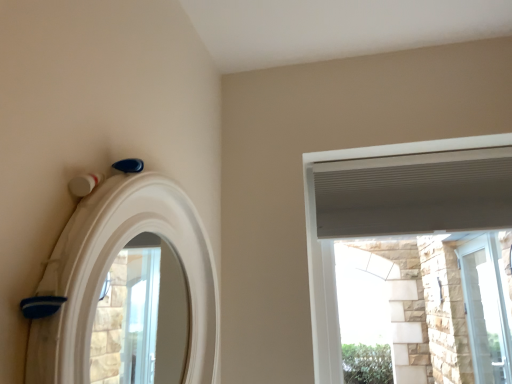
Question: Is white textured window at upper right, marked as the first window in a left-to-right arrangement, taller or shorter than white matte archway at upper left?

Choices:
 (A) tall
 (B) short

Answer: (A)

Question: Is point (423, 173) closer or farther from the camera than point (93, 238)?

Choices:
 (A) farther
 (B) closer

Answer: (A)

Question: Considering the real-world distances, which object is closest to the white matte archway at upper left?

Choices:
 (A) white textured window at upper right, marked as the 1th window in a top-to-bottom arrangement
 (B) clear glass door at right, the 1th window in the back-to-front sequence

Answer: (A)

Question: Which is farther from the white matte archway at upper left?

Choices:
 (A) white textured window at upper right, which appears as the 2th window when viewed from the right
 (B) clear glass door at right, the 1th window in the back-to-front sequence

Answer: (B)